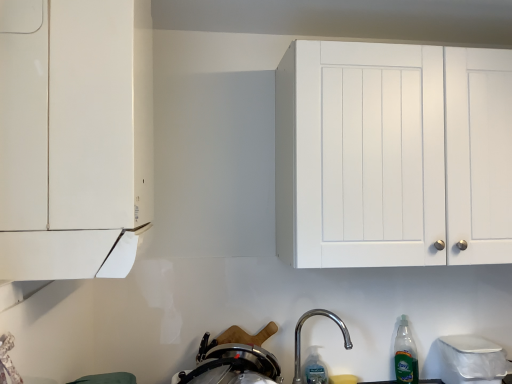
Question: Considering the relative sizes of polished metallic faucet at lower center and green translucent bottle at lower right, the second bottle viewed from the left, in the image provided, is polished metallic faucet at lower center wider than green translucent bottle at lower right, the second bottle viewed from the left,?

Choices:
 (A) yes
 (B) no

Answer: (A)

Question: Can you confirm if polished metallic faucet at lower center is positioned to the left of green translucent bottle at lower right, which is counted as the first bottle, starting from the right?

Choices:
 (A) no
 (B) yes

Answer: (B)

Question: Is polished metallic faucet at lower center smaller than green translucent bottle at lower right, the second bottle viewed from the left?

Choices:
 (A) yes
 (B) no

Answer: (B)

Question: Is polished metallic faucet at lower center at the right side of green translucent bottle at lower right, which is counted as the first bottle, starting from the right?

Choices:
 (A) yes
 (B) no

Answer: (B)

Question: Is polished metallic faucet at lower center taller than green translucent bottle at lower right, which is counted as the first bottle, starting from the right?

Choices:
 (A) no
 (B) yes

Answer: (B)

Question: In the image, is white matte cabinet at left, marked as the first cabinetry in a left-to-right arrangement, on the left side or the right side of clear plastic bottle at lower center, which appears as the 1th bottle when viewed from the left?

Choices:
 (A) right
 (B) left

Answer: (B)

Question: Is point (115, 52) closer or farther from the camera than point (320, 375)?

Choices:
 (A) farther
 (B) closer

Answer: (B)

Question: From the image's perspective, is white matte cabinet at left, marked as the first cabinetry in a left-to-right arrangement, located above or below clear plastic bottle at lower center, which appears as the 1th bottle when viewed from the left?

Choices:
 (A) below
 (B) above

Answer: (B)

Question: From a real-world perspective, relative to clear plastic bottle at lower center, which appears as the 1th bottle when viewed from the left, is white matte cabinet at left, the 2th cabinetry in the right-to-left sequence, vertically above or below?

Choices:
 (A) above
 (B) below

Answer: (A)

Question: Considering the positions of point (256, 342) and point (424, 168), is point (256, 342) closer or farther from the camera than point (424, 168)?

Choices:
 (A) farther
 (B) closer

Answer: (A)

Question: Is stainless steel pot at lower center to the left or to the right of white matte cabinet at upper right, which appears as the second cabinetry when viewed from the front, in the image?

Choices:
 (A) left
 (B) right

Answer: (A)

Question: Considering the positions of stainless steel pot at lower center and white matte cabinet at upper right, which appears as the second cabinetry when viewed from the front, in the image, is stainless steel pot at lower center taller or shorter than white matte cabinet at upper right, which appears as the second cabinetry when viewed from the front,?

Choices:
 (A) short
 (B) tall

Answer: (A)

Question: Based on their sizes in the image, would you say stainless steel pot at lower center is bigger or smaller than white matte cabinet at upper right, which appears as the first cabinetry when viewed from the back?

Choices:
 (A) big
 (B) small

Answer: (B)

Question: From the image's perspective, is green translucent bottle at lower right, which is counted as the first bottle, starting from the right, located above or below stainless steel pot at lower center?

Choices:
 (A) above
 (B) below

Answer: (B)

Question: Is green translucent bottle at lower right, the second bottle viewed from the left, inside or outside of stainless steel pot at lower center?

Choices:
 (A) inside
 (B) outside

Answer: (B)